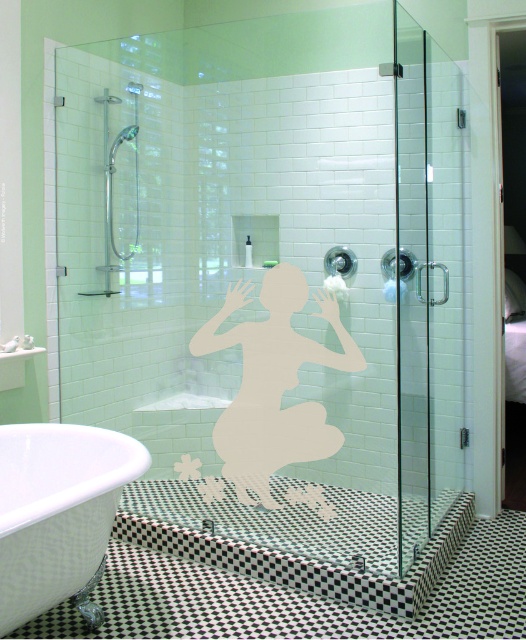
Between white glossy bathtub at lower left and white matte silhouette at center, which one is positioned lower?

white glossy bathtub at lower left

Can you confirm if white glossy bathtub at lower left is positioned to the right of white matte silhouette at center?

In fact, white glossy bathtub at lower left is to the left of white matte silhouette at center.

Image resolution: width=526 pixels, height=640 pixels. Describe the element at coordinates (57, 513) in the screenshot. I see `white glossy bathtub at lower left` at that location.

What are the coordinates of `white glossy bathtub at lower left` in the screenshot? It's located at (57, 513).